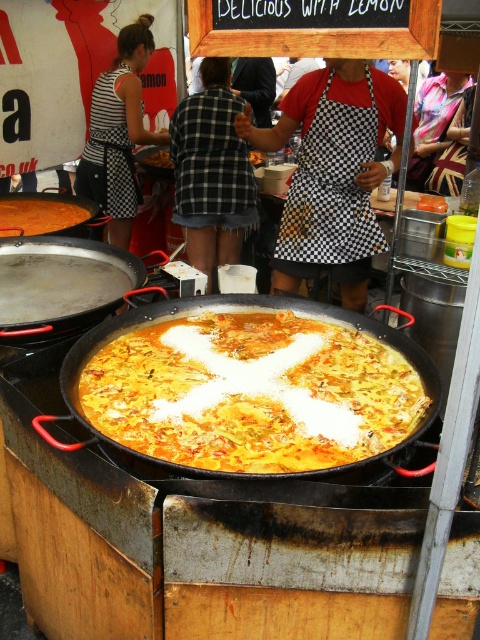
Who is lower down, black checkered apron at center or brown crispy pastry at center?

black checkered apron at center is below.

Which is behind, point (200, 230) or point (166, 154)?

The point (166, 154) is more distant.

Is point (210, 275) positioned after point (168, 156)?

No, it is in front of (168, 156).

Where is `black checkered apron at center`? The height and width of the screenshot is (640, 480). black checkered apron at center is located at coordinates (212, 172).

Does point (73, 288) come closer to viewer compared to point (59, 204)?

Yes, point (73, 288) is closer to viewer.

Is point (6, 289) positioned behind point (13, 205)?

No, it is not.

Between point (58, 323) and point (36, 232), which one is positioned behind?

The point (36, 232) is behind.

Find the location of `matte black wok at center`. matte black wok at center is located at coordinates (60, 284).

Is shiny black wok at center behind yellowish matte paella at center?

No, it is not.

Does point (160, 326) come behind point (27, 205)?

That is False.

I want to click on shiny black wok at center, so click(x=250, y=365).